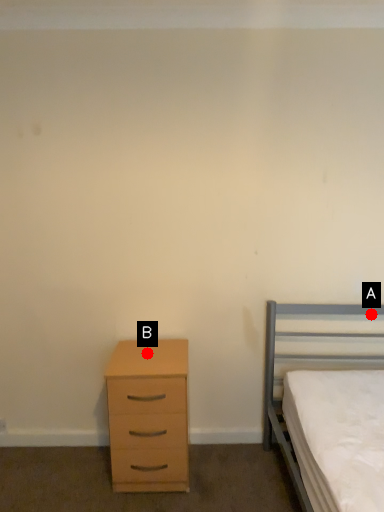
Question: Two points are circled on the image, labeled by A and B beside each circle. Which of the following is the closest to the observer?

Choices:
 (A) A is closer
 (B) B is closer

Answer: (B)